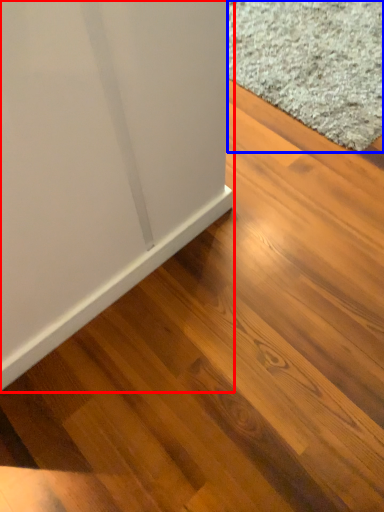
Question: Which of the following is the closest to the observer, furniture (highlighted by a red box) or doormat (highlighted by a blue box)?

Choices:
 (A) furniture
 (B) doormat

Answer: (A)